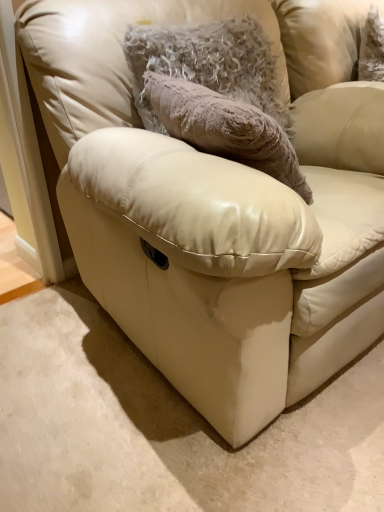
In order to face fuzzy gray pillow at upper center, should I rotate leftwards or rightwards?

Turn right approximately 3.766 degrees to face it.

Identify the location of fuzzy gray pillow at upper center. (207, 63).

This screenshot has width=384, height=512. What do you see at coordinates (207, 63) in the screenshot?
I see `fuzzy gray pillow at upper center` at bounding box center [207, 63].

Locate an element on the screen. fuzzy gray pillow at upper center is located at coordinates (207, 63).